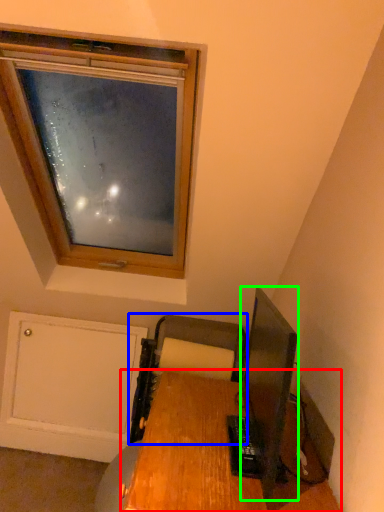
Question: Which object is positioned closest to desk (highlighted by a red box)? Select from printer (highlighted by a blue box) and television (highlighted by a green box).

Choices:
 (A) printer
 (B) television

Answer: (A)